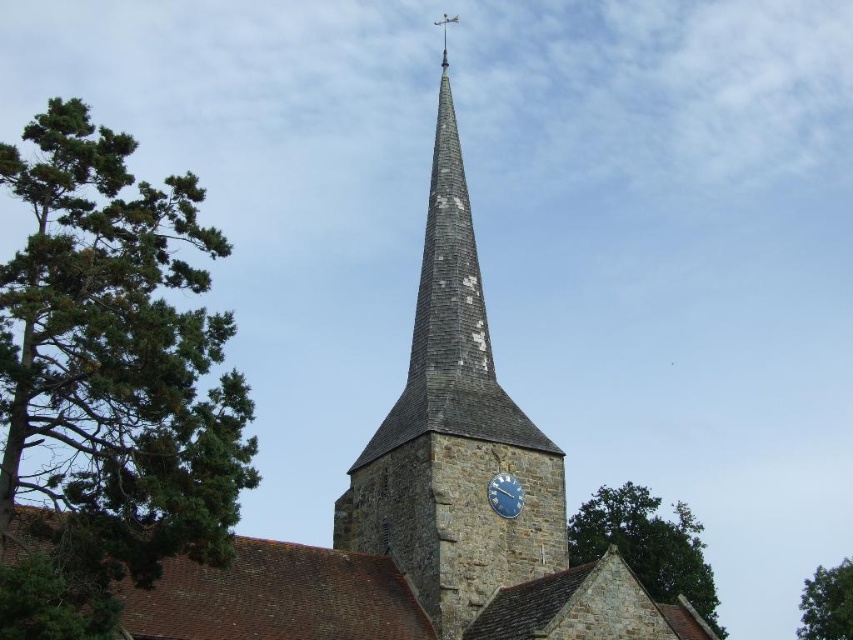
Which of these two, green needle-like leaves at left or blue metallic clock at center, stands shorter?

blue metallic clock at center

Does point (161, 378) come closer to viewer compared to point (519, 513)?

That is True.

Locate an element on the screen. Image resolution: width=853 pixels, height=640 pixels. green needle-like leaves at left is located at coordinates (109, 381).

Does green leafy tree at upper center appear on the right side of blue metallic clock at center?

Indeed, green leafy tree at upper center is positioned on the right side of blue metallic clock at center.

At what (x,y) coordinates should I click in order to perform the action: click on green leafy tree at upper center. Please return your answer as a coordinate pair (x, y). Looking at the image, I should click on (827, 604).

Image resolution: width=853 pixels, height=640 pixels. I want to click on green leafy tree at upper center, so click(x=827, y=604).

Who is taller, green leafy tree at lower right or blue metallic clock at center?

With more height is green leafy tree at lower right.

Which of these two, green leafy tree at lower right or blue metallic clock at center, stands shorter?

blue metallic clock at center

Between point (659, 525) and point (492, 490), which one is positioned behind?

Positioned behind is point (659, 525).

At what (x,y) coordinates should I click in order to perform the action: click on green leafy tree at lower right. Please return your answer as a coordinate pair (x, y). The height and width of the screenshot is (640, 853). Looking at the image, I should click on (647, 545).